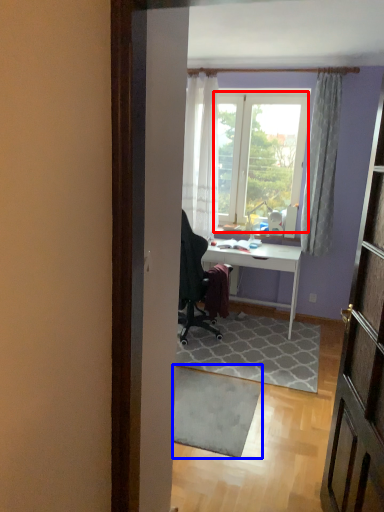
Question: Which of the following is the closest to the observer, window screen (highlighted by a red box) or doormat (highlighted by a blue box)?

Choices:
 (A) window screen
 (B) doormat

Answer: (B)